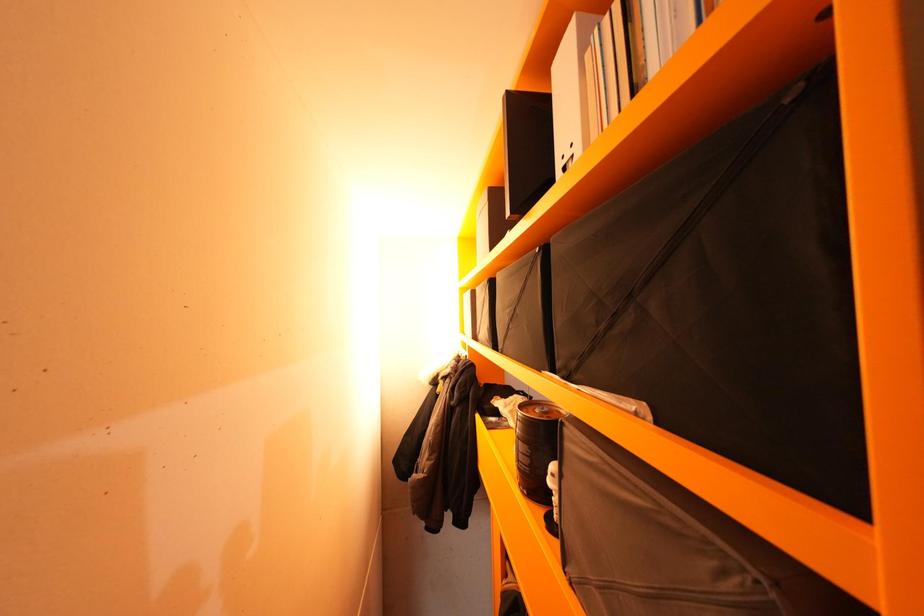
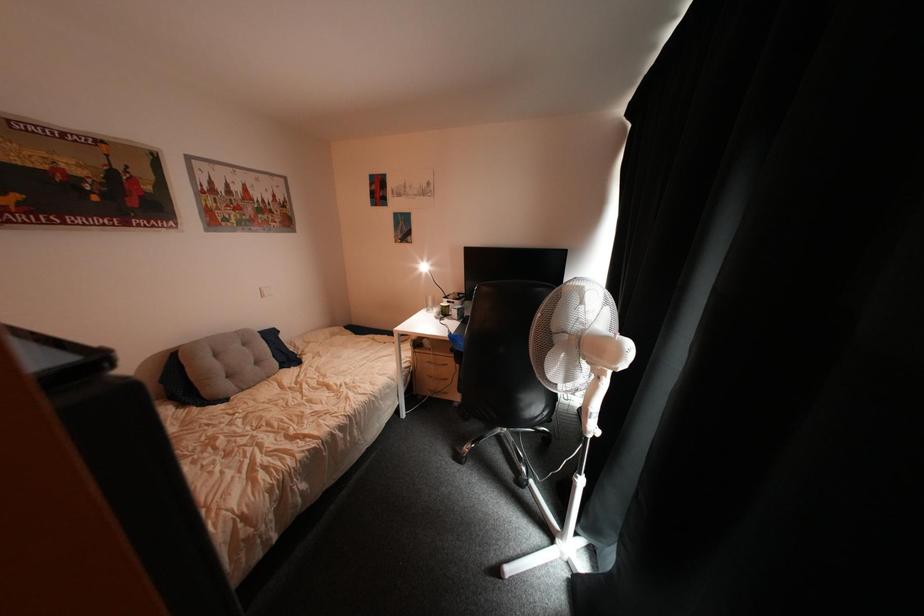
The images are taken continuously from a first-person perspective. In which direction is your viewpoint rotating?

The camera's rotation is toward right-down.